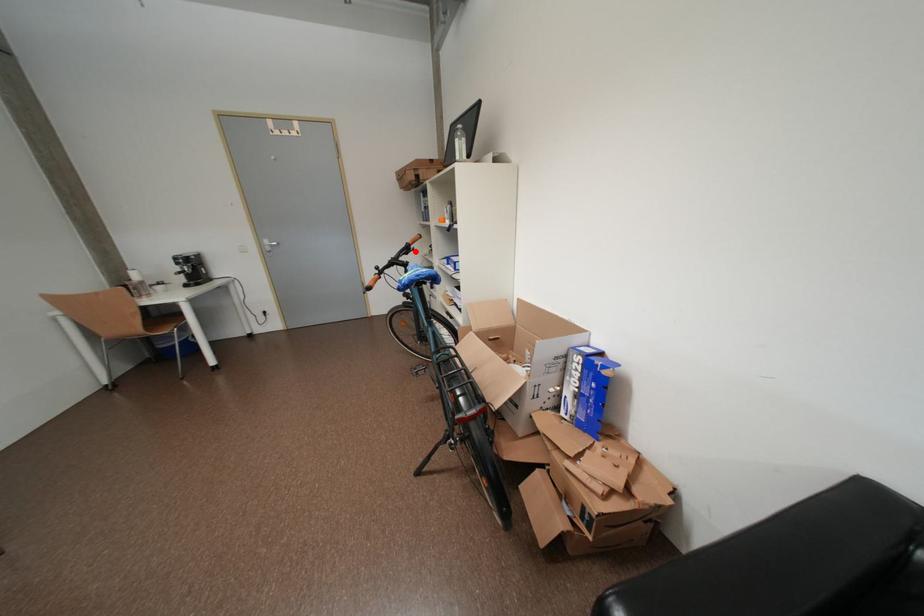
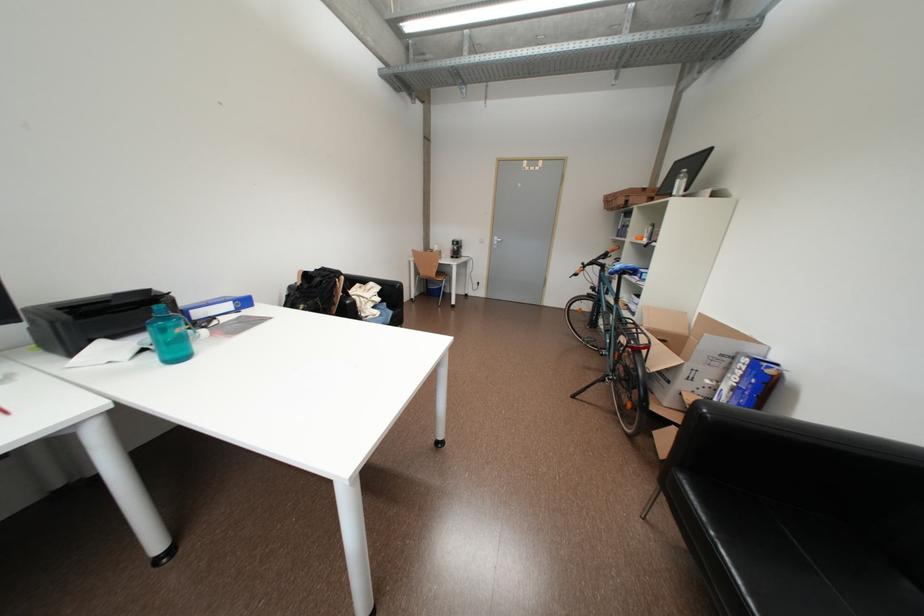
The point at the highlighted location is marked in the first image. Where is the corresponding point in the second image?

(613, 257)